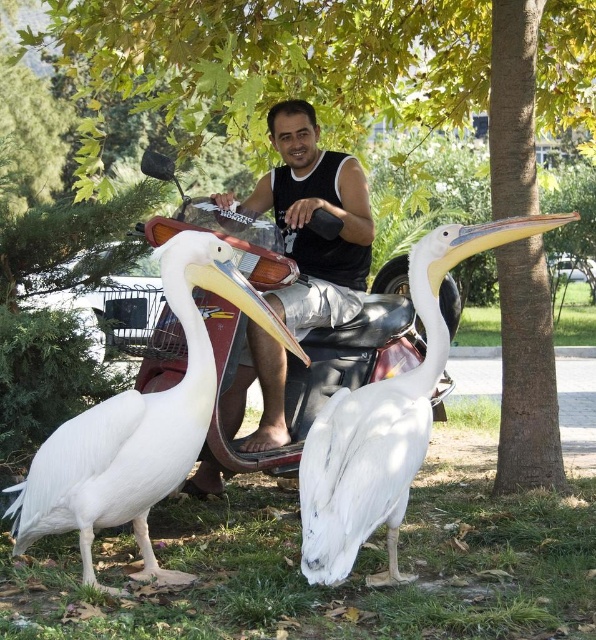
Question: From the image, what is the correct spatial relationship of white matte pelican at center in relation to black matte tank top at center?

Choices:
 (A) above
 (B) below

Answer: (B)

Question: Which object is closer to the camera taking this photo?

Choices:
 (A) black matte tank top at center
 (B) white feathered pelican at center

Answer: (B)

Question: Observing the image, what is the correct spatial positioning of white matte pelican at center in reference to white feathered pelican at center?

Choices:
 (A) right
 (B) left

Answer: (B)

Question: Which object appears closest to the camera in this image?

Choices:
 (A) black matte tank top at center
 (B) white feathered pelican at center

Answer: (B)

Question: Is white matte pelican at center positioned behind black matte tank top at center?

Choices:
 (A) yes
 (B) no

Answer: (B)

Question: Which of these objects is positioned farthest from the white matte pelican at center?

Choices:
 (A) black matte tank top at center
 (B) white feathered pelican at center

Answer: (A)